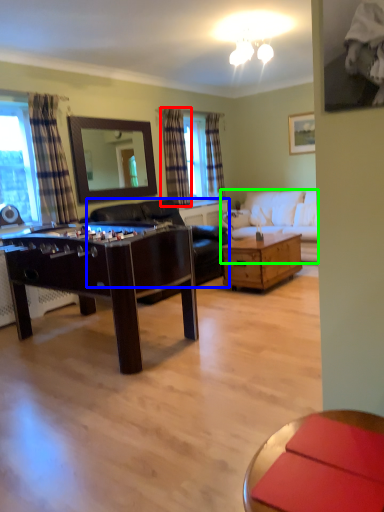
Question: Which object is the farthest from curtain (highlighted by a red box)? Choose among these: futon (highlighted by a blue box) or studio couch (highlighted by a green box).

Choices:
 (A) futon
 (B) studio couch

Answer: (B)